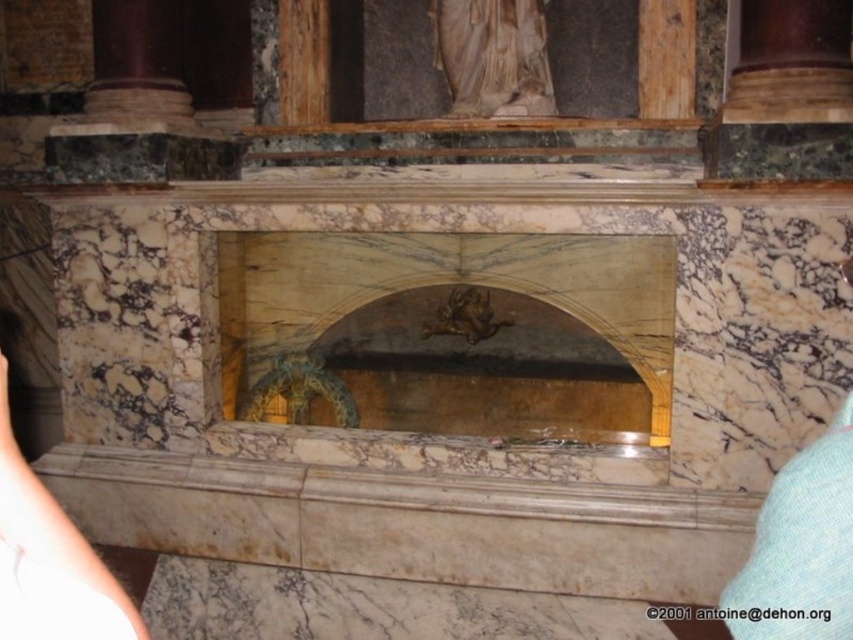
You are an art curator planning to place a new sculpture between the white marble statue at upper center and the gold metallic sculpture at center. Given their sizes, which existing sculpture should the new sculpture be placed closer to?

The white marble statue at upper center is larger than the gold metallic sculpture at center, so the new sculpture should be placed closer to the gold metallic sculpture at center to maintain balance.

You are an art conservator examining the marble structure. You notice the skinny white arm at lower left and the gold metallic sculpture at center. Which object is positioned lower in the scene?

The skinny white arm at lower left is positioned lower than the gold metallic sculpture at center.